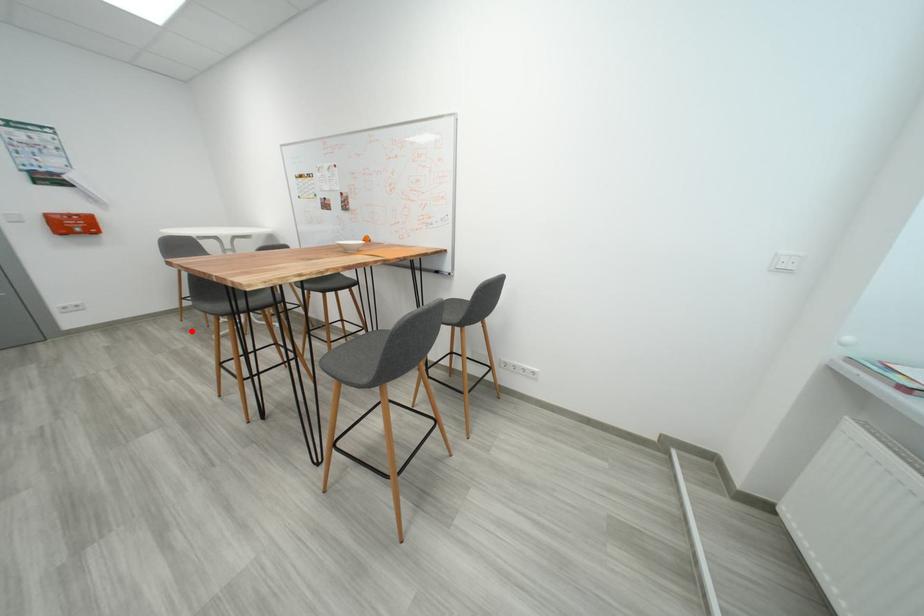
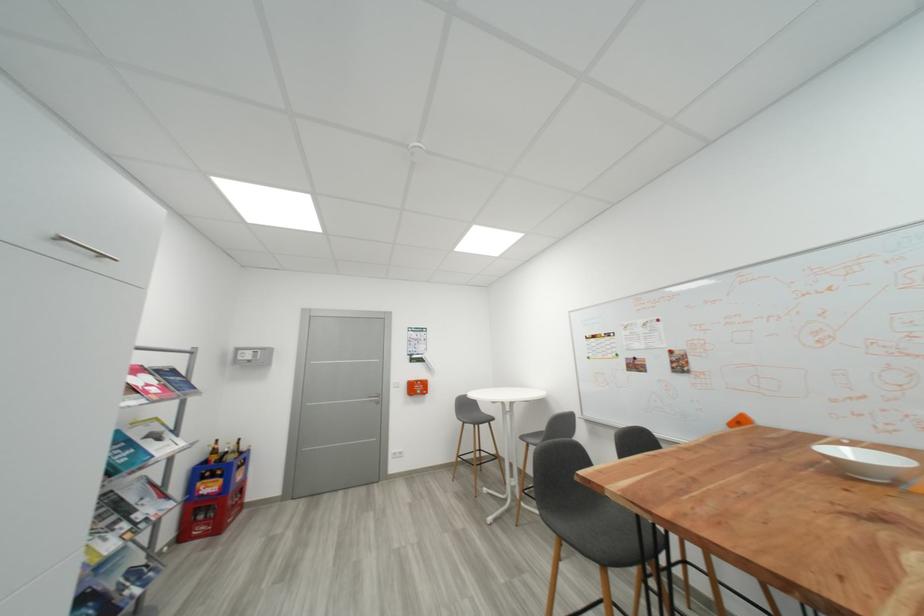
Question: A red point is marked in image1. In image2, is the corresponding 3D point closer to the camera or farther? Reply with the corresponding letter.

Choices:
 (A) The corresponding 3D point is closer.
 (B) The corresponding 3D point is farther.

Answer: (A)